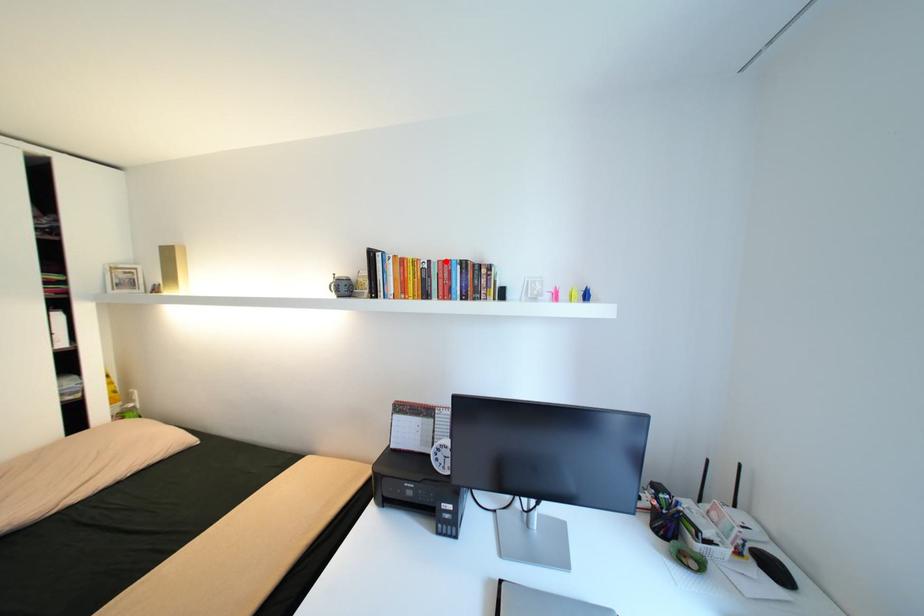
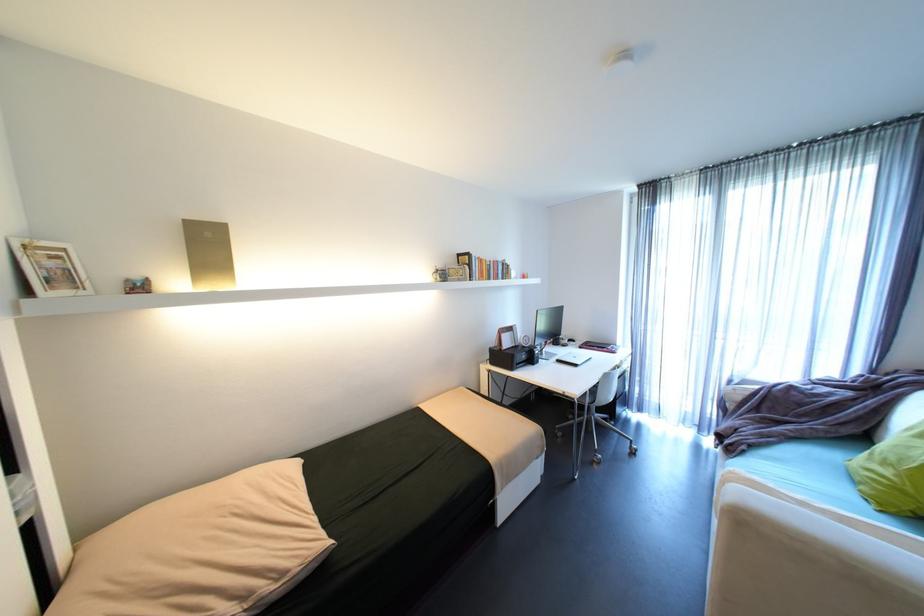
Where in the second image is the point corresponding to the highlighted location from the first image?

(500, 262)